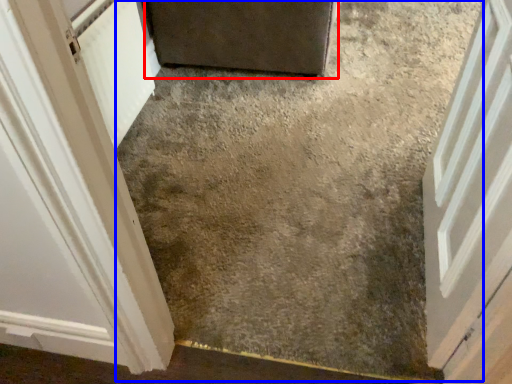
Question: Which object appears farthest to the camera in this image, door (highlighted by a red box) or concrete (highlighted by a blue box)?

Choices:
 (A) door
 (B) concrete

Answer: (A)